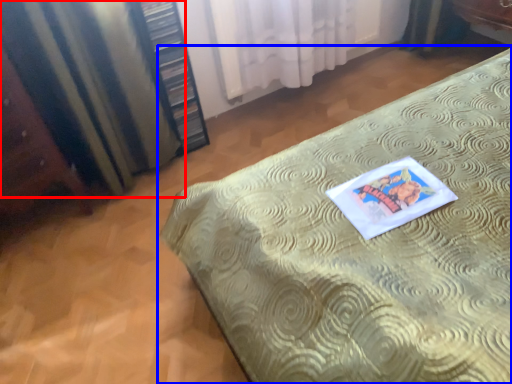
Question: Which object appears farthest to the camera in this image, curtain (highlighted by a red box) or bed (highlighted by a blue box)?

Choices:
 (A) curtain
 (B) bed

Answer: (A)